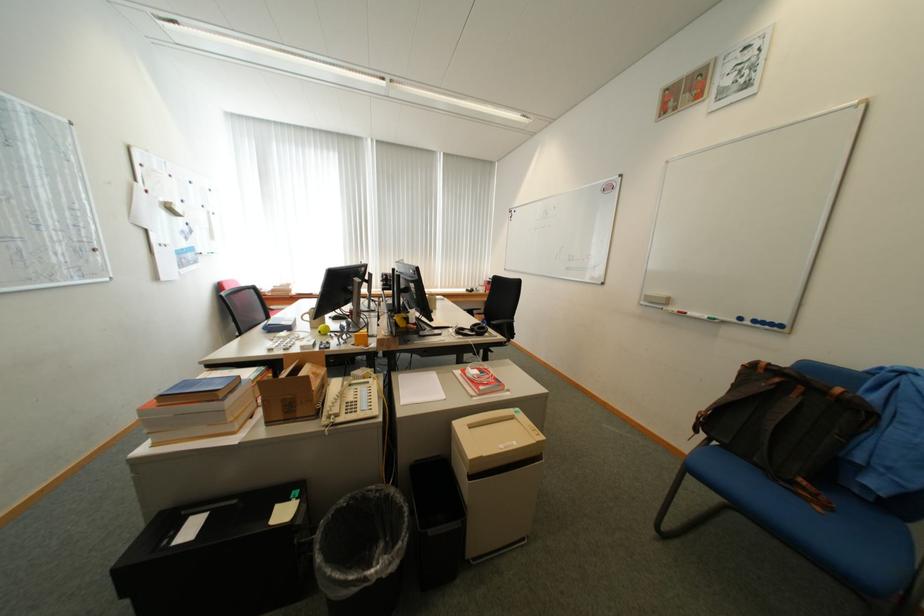
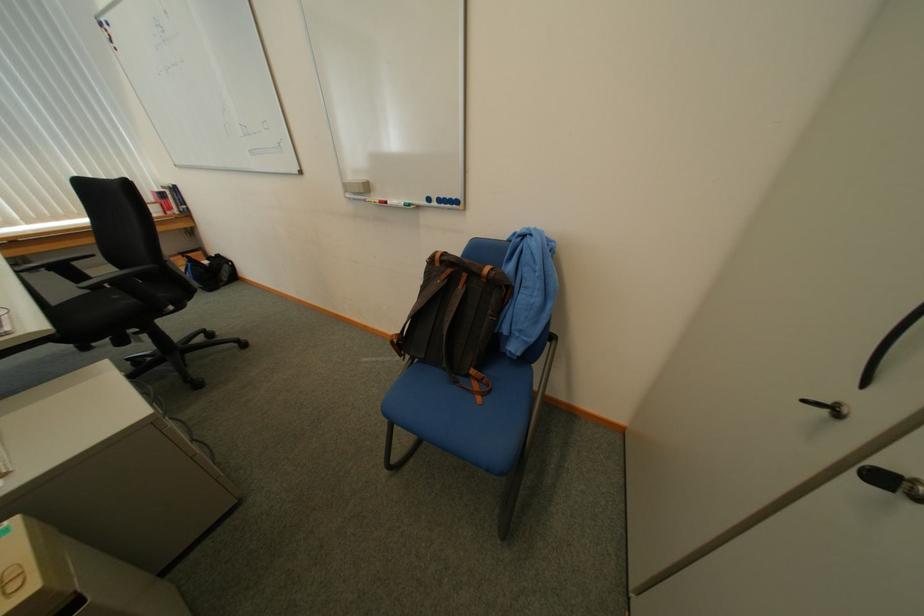
In the second image, find the point that corresponds to the point at 827,509 in the first image.

(489, 400)